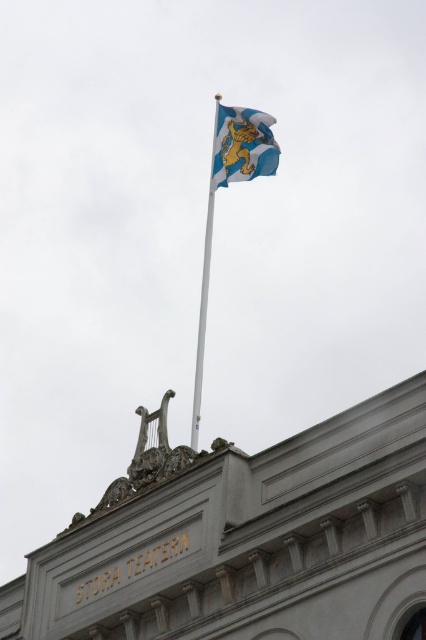
Question: Is blue and white fabric flag at upper center bigger than white metallic flag pole at upper center?

Choices:
 (A) no
 (B) yes

Answer: (A)

Question: Which object appears farthest from the camera in this image?

Choices:
 (A) blue and white fabric flag at upper center
 (B) white metallic flag pole at upper center

Answer: (A)

Question: Is blue and white fabric flag at upper center positioned behind white metallic flag pole at upper center?

Choices:
 (A) no
 (B) yes

Answer: (B)

Question: Which of the following is the closest to the observer?

Choices:
 (A) (206, 250)
 (B) (238, 115)

Answer: (B)

Question: Is blue and white fabric flag at upper center below white metallic flag pole at upper center?

Choices:
 (A) yes
 (B) no

Answer: (B)